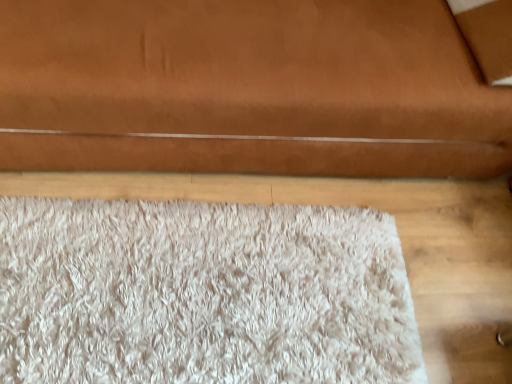
Locate an element on the screen. This screenshot has width=512, height=384. brown leather couch at upper center is located at coordinates (247, 89).

What do you see at coordinates (247, 89) in the screenshot? I see `brown leather couch at upper center` at bounding box center [247, 89].

Locate an element on the screen. This screenshot has height=384, width=512. brown leather couch at upper center is located at coordinates (247, 89).